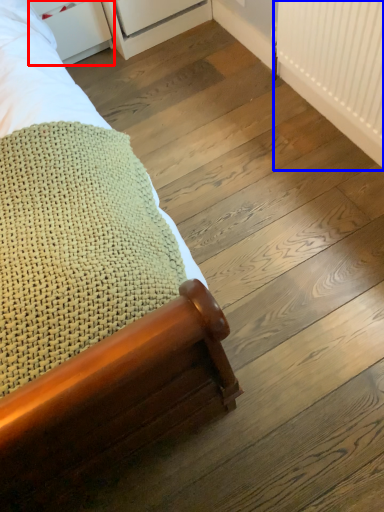
Question: Which object is further to the camera taking this photo, drawer (highlighted by a red box) or radiator (highlighted by a blue box)?

Choices:
 (A) drawer
 (B) radiator

Answer: (A)